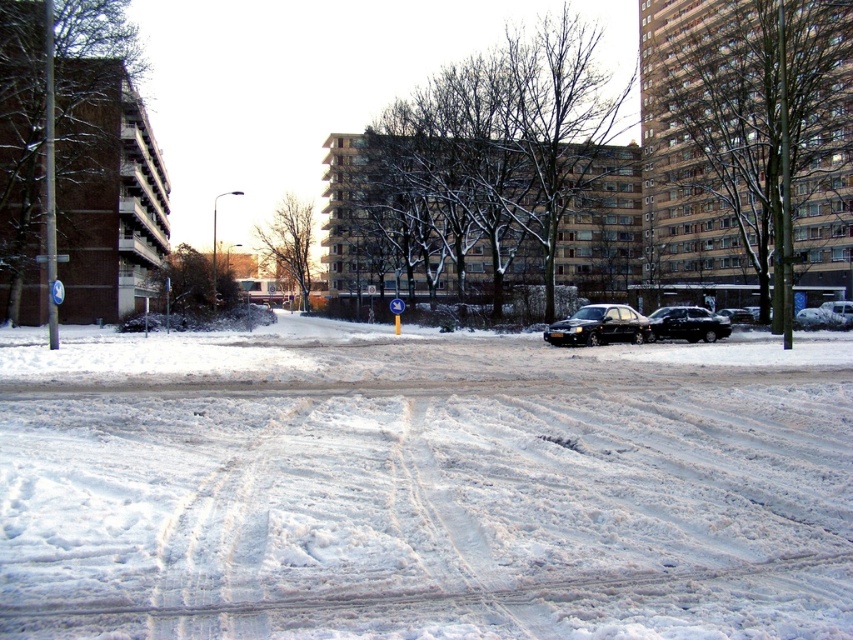
Which is more to the right, black glossy sedan at center or white glossy car at lower right?

white glossy car at lower right

Is point (544, 340) positioned behind point (834, 323)?

That is False.

This screenshot has width=853, height=640. In order to click on black glossy sedan at center in this screenshot , I will do `click(598, 326)`.

Between shiny black car at center and white glossy car at lower right, which one is positioned lower?

shiny black car at center is below.

Between point (654, 332) and point (842, 323), which one is positioned in front?

Point (654, 332)

Where is `shiny black car at center`? The width and height of the screenshot is (853, 640). shiny black car at center is located at coordinates (688, 324).

Where is `white powdery snow at center`? The height and width of the screenshot is (640, 853). white powdery snow at center is located at coordinates (422, 484).

Is white powdery snow at center smaller than white glossy car at lower right?

No.

Does point (259, 474) come farther from viewer compared to point (798, 320)?

No, (259, 474) is closer to viewer.

Image resolution: width=853 pixels, height=640 pixels. Identify the location of white powdery snow at center. (422, 484).